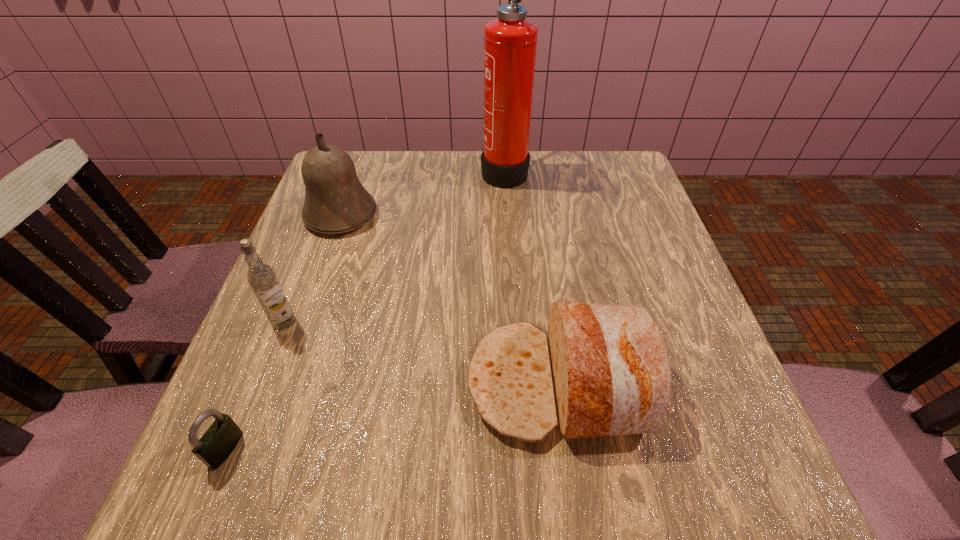
Where is `vacant space located on the label of the vodka`? The width and height of the screenshot is (960, 540). vacant space located on the label of the vodka is located at coordinates (253, 401).

This screenshot has height=540, width=960. Identify the location of free space located 0.070m at the sliced end of the bread. pos(426,382).

Locate an element on the screen. This screenshot has width=960, height=540. free space located at the sliced end of the bread is located at coordinates (302, 382).

The width and height of the screenshot is (960, 540). Find the location of `vacant space located 0.200m at the sliced end of the bread`. vacant space located 0.200m at the sliced end of the bread is located at coordinates (349, 382).

In order to click on free space located 0.080m on the back of the padlock in this screenshot , I will do `click(252, 384)`.

Locate an element on the screen. The image size is (960, 540). fire extinguisher situated at the far edge is located at coordinates (510, 41).

Image resolution: width=960 pixels, height=540 pixels. In order to click on bell at the far edge in this screenshot , I will do `click(336, 202)`.

You are a GUI agent. You are given a task and a screenshot of the screen. Output one action in this format:
    pyautogui.click(x=<x>, y=<y>)
    Task: Click on the object located at the near edge
    Image resolution: width=960 pixels, height=540 pixels.
    Given the screenshot: What is the action you would take?
    pyautogui.click(x=220, y=439)

Where is `bell that is positioned at the left edge`? bell that is positioned at the left edge is located at coordinates (336, 202).

What are the coordinates of `vodka that is at the left edge` in the screenshot? It's located at (262, 278).